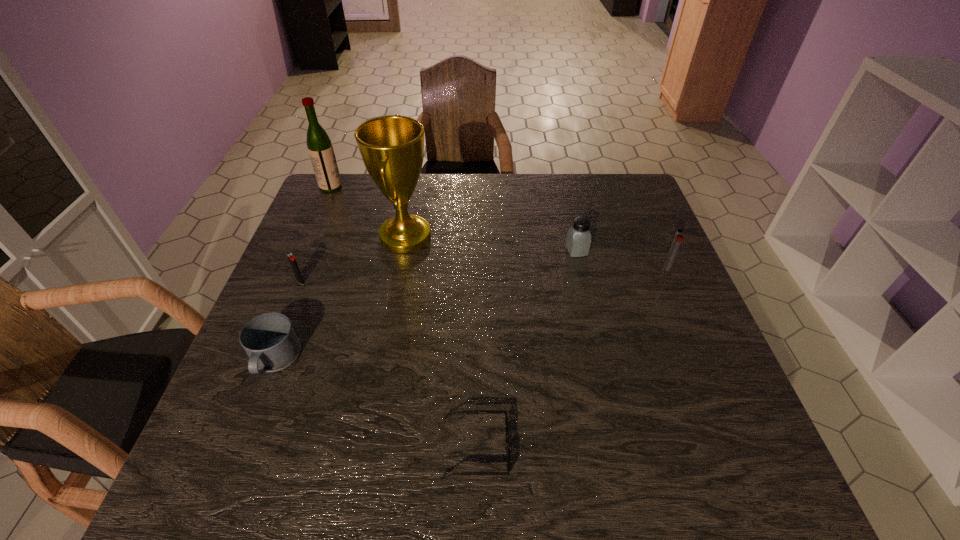
Identify the location of vacant area between the third object from right to left and the right igniter. (571, 358).

Where is `object that is the sixth closest one to the sixth object from left to right`? This screenshot has height=540, width=960. object that is the sixth closest one to the sixth object from left to right is located at coordinates (320, 148).

The image size is (960, 540). In order to click on the closest object to the farthest object in this screenshot , I will do pos(392,147).

The image size is (960, 540). In order to click on vacant position in the image that satisfies the following two spatial constraints: 1. by the handles of the second object from right to left; 2. on the right side of the award in this screenshot , I will do `click(403, 251)`.

Identify the location of free spot that satisfies the following two spatial constraints: 1. by the handles of the right igniter; 2. on the right side of the award. The image size is (960, 540). (400, 267).

You are a GUI agent. You are given a task and a screenshot of the screen. Output one action in this format:
    pyautogui.click(x=<x>, y=<y>)
    Task: Click on the free region that satisfies the following two spatial constraints: 1. on the label of the second object from right to left; 2. on the right side of the liquor
    The height and width of the screenshot is (540, 960).
    Given the screenshot: What is the action you would take?
    pyautogui.click(x=304, y=251)

In order to click on free spot that satisfies the following two spatial constraints: 1. by the handles of the fourth object from left to right; 2. on the back side of the saltshaker in this screenshot , I will do pyautogui.click(x=403, y=251).

Identify the location of vacant space that satisfies the following two spatial constraints: 1. on the back side of the saltshaker; 2. on the label of the farthest object. This screenshot has width=960, height=540. (562, 187).

The image size is (960, 540). I want to click on vacant point that satisfies the following two spatial constraints: 1. on the label of the saltshaker; 2. on the left side of the liquor, so click(304, 251).